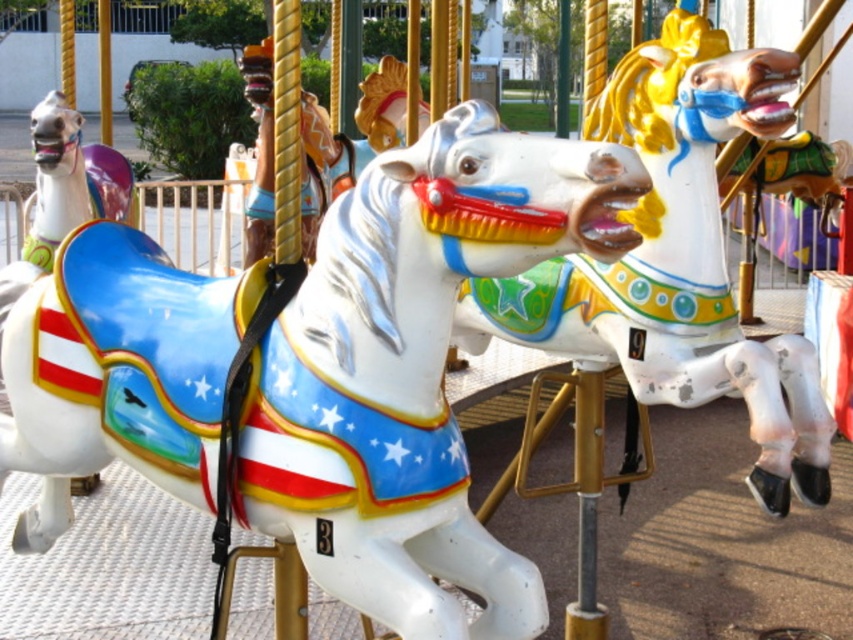
You are at a carousel and want to choose the bigger horse to ride. Which horse should you pick between the white glossy horse at center and the shiny white horse at left?

You should choose the white glossy horse at center because it has a larger size compared to the shiny white horse at left.

You are standing at the center of the carousel and want to locate the white glossy horse at center. What are its coordinates?

The white glossy horse at center is located at coordinates point [413,369].